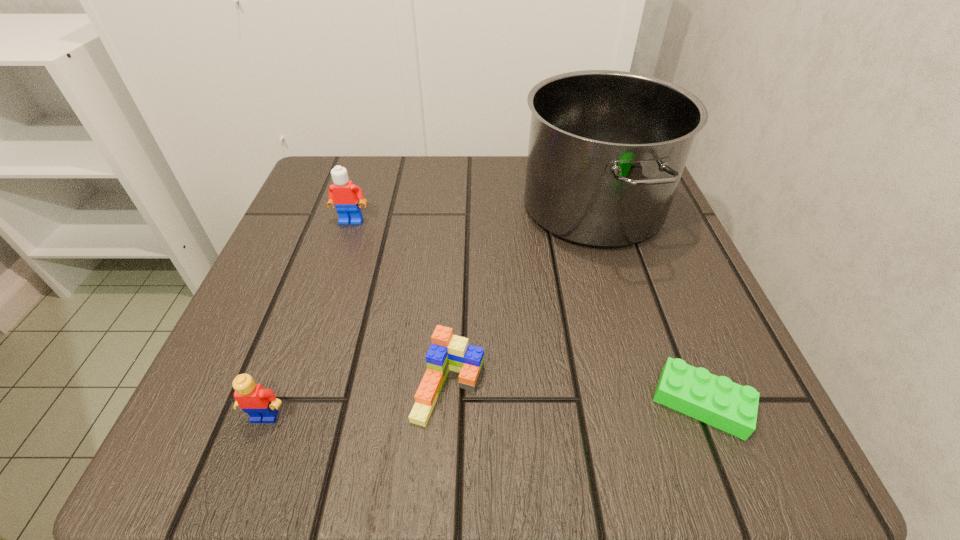
This screenshot has height=540, width=960. What are the coordinates of `vacant space located 0.360m on the back of the second Lego from right to left` in the screenshot? It's located at (459, 207).

Locate an element on the screen. The height and width of the screenshot is (540, 960). vacant area located 0.270m on the left of the shortest Lego is located at coordinates (450, 402).

You are a GUI agent. You are given a task and a screenshot of the screen. Output one action in this format:
    pyautogui.click(x=<x>, y=<y>)
    Task: Click on the saucepan present at the far edge
    
    Given the screenshot: What is the action you would take?
    pyautogui.click(x=607, y=149)

You are a GUI agent. You are given a task and a screenshot of the screen. Output one action in this format:
    pyautogui.click(x=<x>, y=<y>)
    Task: Click on the Lego located at the far edge
    
    Given the screenshot: What is the action you would take?
    pyautogui.click(x=343, y=194)

The height and width of the screenshot is (540, 960). I want to click on saucepan present at the right edge, so click(607, 149).

In order to click on Lego that is at the right edge in this screenshot , I will do `click(717, 401)`.

The width and height of the screenshot is (960, 540). Identify the location of object that is at the far left corner. click(x=343, y=194).

Locate an element on the screen. Image resolution: width=960 pixels, height=540 pixels. object at the near left corner is located at coordinates (260, 404).

The width and height of the screenshot is (960, 540). Find the location of `object at the far right corner`. object at the far right corner is located at coordinates (607, 149).

The height and width of the screenshot is (540, 960). I want to click on object located at the near right corner, so click(717, 401).